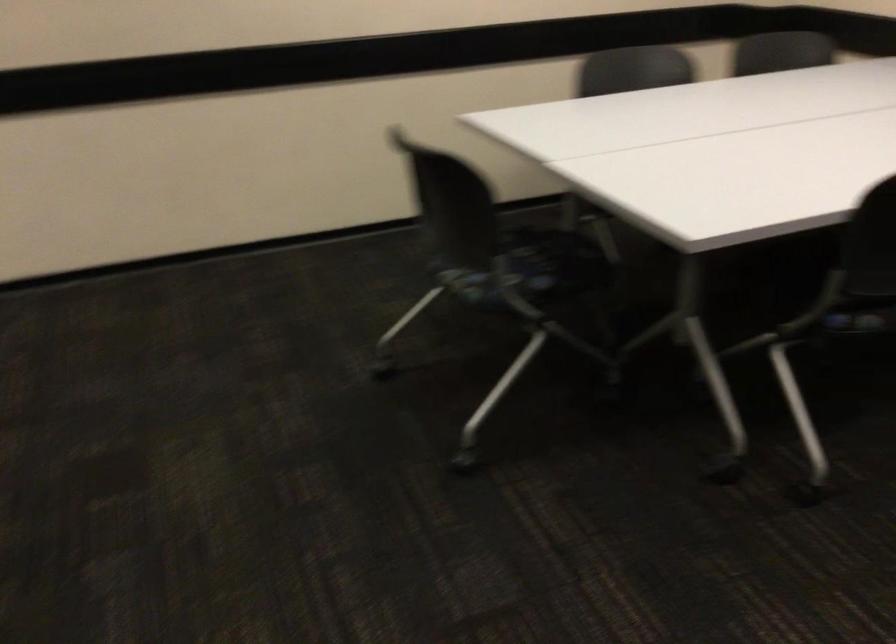
Identify the location of chair sitting surface. (494, 285).